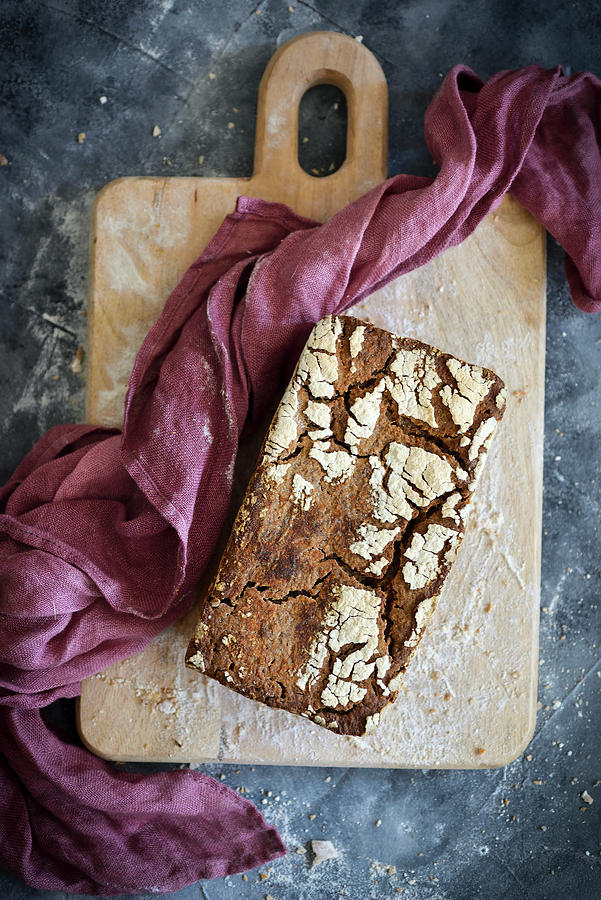
Where is `cutting board`? cutting board is located at coordinates (181, 717).